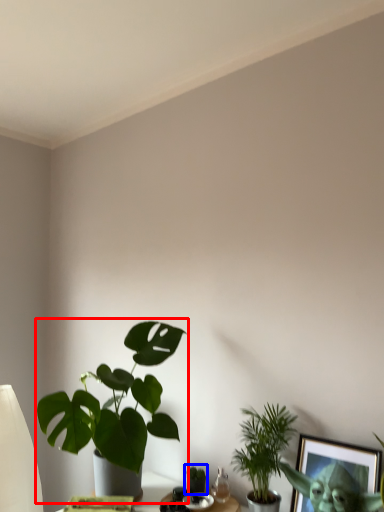
Question: Which object is further to the camera taking this photo, houseplant (highlighted by a red box) or houseplant (highlighted by a blue box)?

Choices:
 (A) houseplant
 (B) houseplant

Answer: (B)